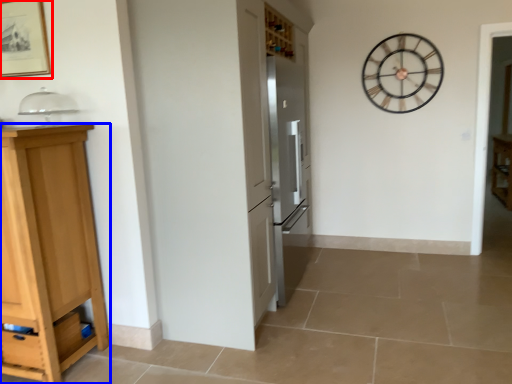
Question: Which object appears closest to the camera in this image, picture frame (highlighted by a red box) or cabinetry (highlighted by a blue box)?

Choices:
 (A) picture frame
 (B) cabinetry

Answer: (B)